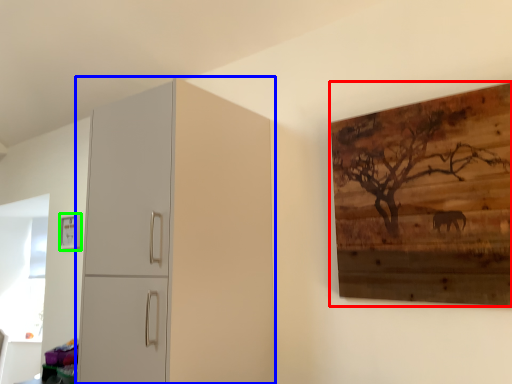
Question: Considering the real-world distances, which object is closest to picture frame (highlighted by a red box)? cupboard (highlighted by a blue box) or picture frame (highlighted by a green box).

Choices:
 (A) cupboard
 (B) picture frame

Answer: (A)